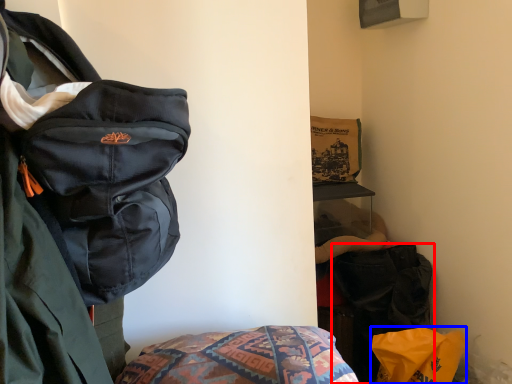
Question: Which of the following is the farthest to the observer, luggage and bags (highlighted by a red box) or material (highlighted by a blue box)?

Choices:
 (A) luggage and bags
 (B) material

Answer: (A)